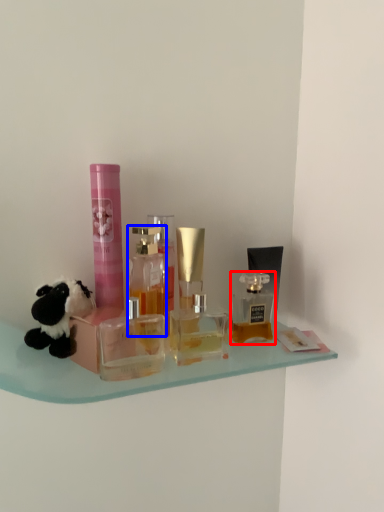
Question: Which object appears farthest to the camera in this image, bottle (highlighted by a red box) or bottle (highlighted by a blue box)?

Choices:
 (A) bottle
 (B) bottle

Answer: (A)